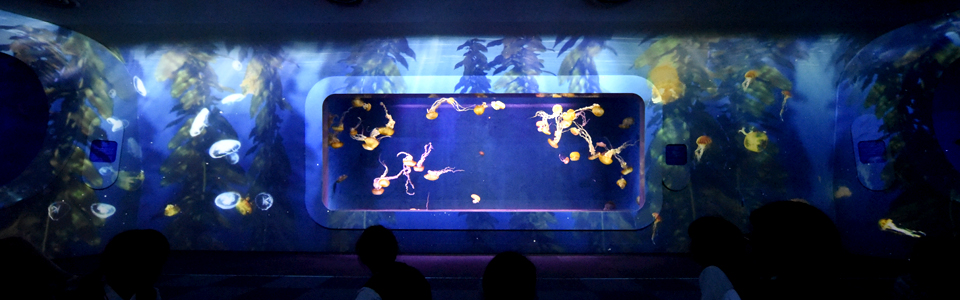
I want to click on light blue lights, so click(628, 64), click(430, 63).